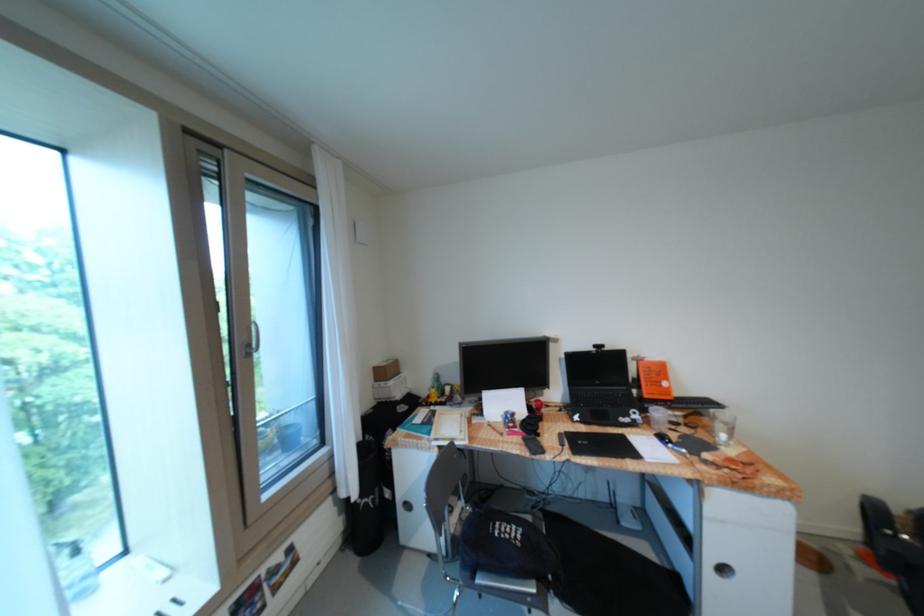
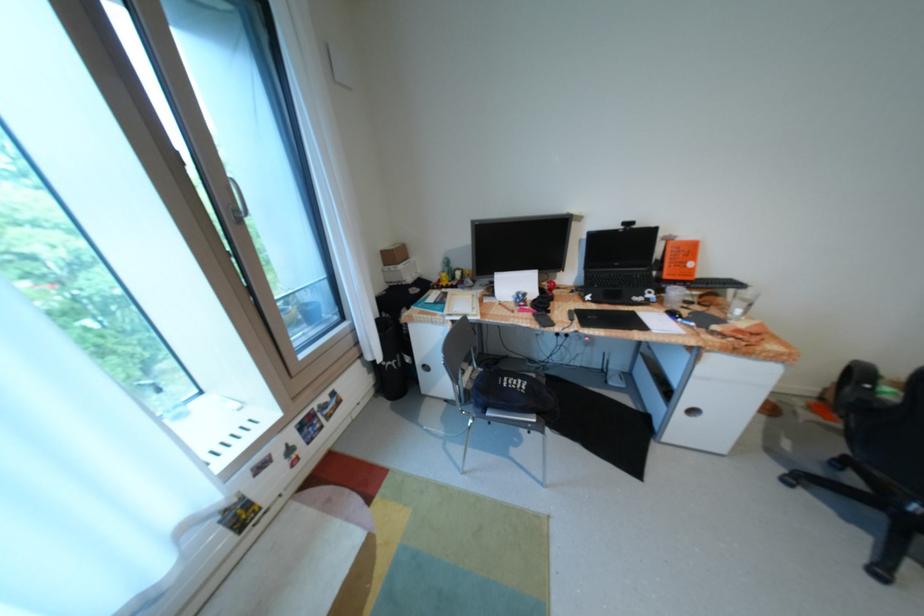
Find the pixel in the second image that matches pixel 671 383 in the first image.

(697, 264)